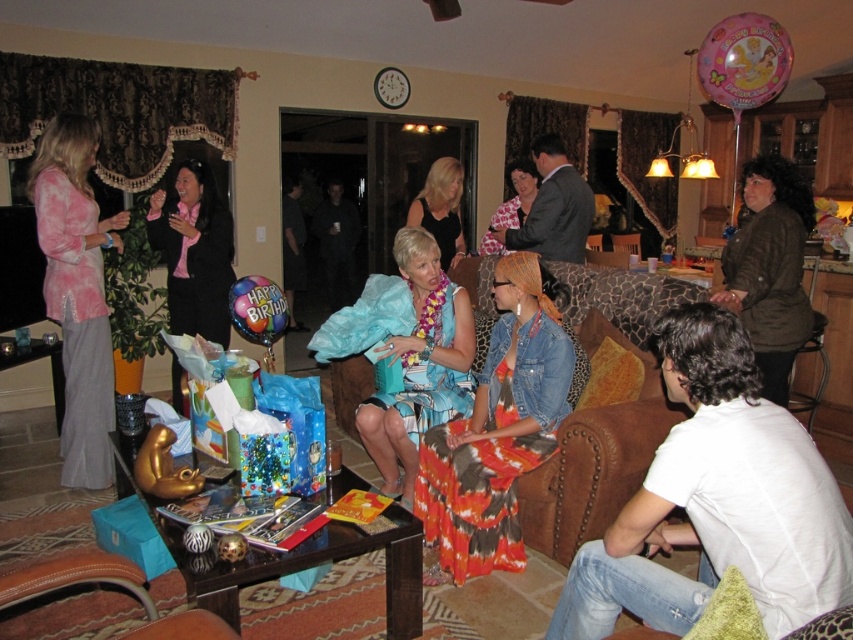
You are a photographer standing in the living room and want to take a picture of the blue satin dress at center. The dress is represented by the point at coordinates point [421,365]. You need to position yourself so that the dress is centered in your frame. Which direction should you move relative to the current position to ensure the dress is centered?

The blue satin dress at center is already centered in the frame since its coordinates are at point [421,365], which corresponds to the center position. Therefore, no movement is needed.

You are standing at the entrance of the living room and want to sit in the brown leather armchair at lower left. Which direction should you walk to reach it?

Since the brown leather armchair at lower left is located at point 0.914 on the x axis and 0.131 on the y axis, you should walk towards the lower left direction to reach it.

You are a guest at the birthday party and want to move from the brown leather armchair at lower left to the blue satin dress at center. The dress is placed on a table. Can you walk directly to the dress without moving any furniture?

The distance between the brown leather armchair at lower left and the blue satin dress at center is 1.50 meters. Since the path is clear and there is enough space, you can walk directly to the dress without needing to move any furniture.